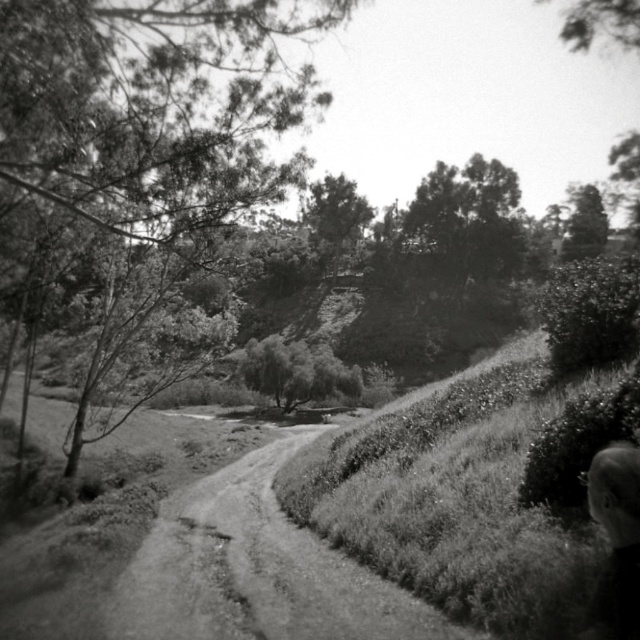
Question: Which object appears closest to the camera in this image?

Choices:
 (A) dark gray hair at lower right
 (B) dirt/gritty at center
 (C) smooth green tree at center

Answer: (A)

Question: Which point is farther from the camera taking this photo?

Choices:
 (A) (244, 525)
 (B) (592, 634)
 (C) (17, 17)

Answer: (A)

Question: Does dirt/gritty at center appear under dark gray hair at lower right?

Choices:
 (A) yes
 (B) no

Answer: (A)

Question: Which object is positioned farthest from the smooth green tree at center?

Choices:
 (A) dark gray hair at lower right
 (B) dirt/gritty at center

Answer: (A)

Question: Does dirt/gritty at center have a smaller size compared to dark gray hair at lower right?

Choices:
 (A) yes
 (B) no

Answer: (B)

Question: Is smooth green tree at center bigger than dark gray hair at lower right?

Choices:
 (A) no
 (B) yes

Answer: (B)